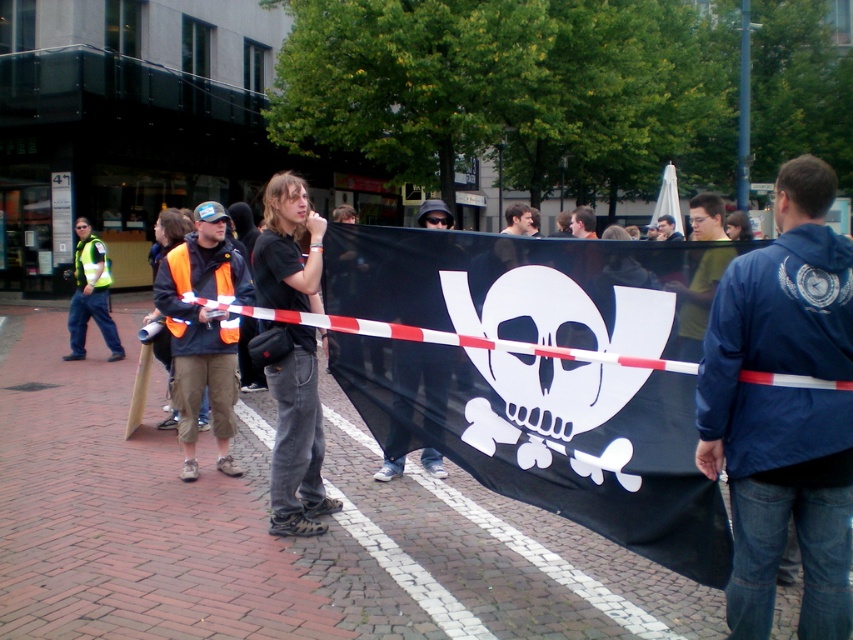
Question: Is reflective orange vest at center above high visibility vest at left?

Choices:
 (A) no
 (B) yes

Answer: (A)

Question: Is reflective orange vest at center to the right of yellow-green t-shirt at center from the viewer's perspective?

Choices:
 (A) yes
 (B) no

Answer: (B)

Question: Which point is closer to the camera taking this photo?

Choices:
 (A) (393, 260)
 (B) (782, 364)
 (C) (434, 467)
 (D) (695, 305)

Answer: (B)

Question: Which object appears farthest from the camera in this image?

Choices:
 (A) high visibility vest at left
 (B) reflective orange vest at center
 (C) black matte shirt at center
 (D) matte black shirt at center

Answer: (A)

Question: Which point is farther to the camera?

Choices:
 (A) black matte shirt at center
 (B) matte black skull at center
 (C) matte black shirt at center
 (D) blue fabric jacket at center

Answer: (C)

Question: Can you confirm if blue fabric jacket at center is positioned above high visibility vest at left?

Choices:
 (A) yes
 (B) no

Answer: (B)